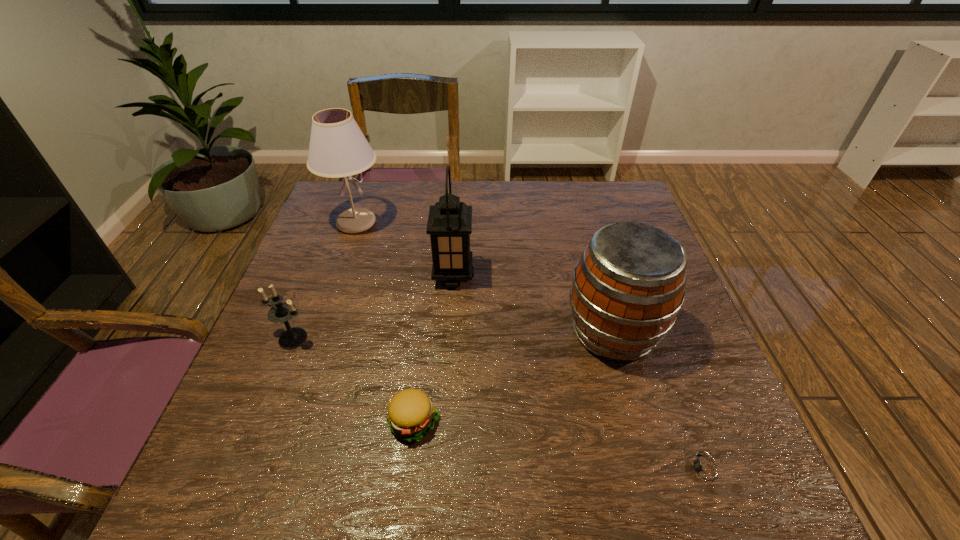
Image resolution: width=960 pixels, height=540 pixels. Find the location of `empty space that is in between the second shortest object and the third tallest object`. empty space that is in between the second shortest object and the third tallest object is located at coordinates (514, 376).

Find the location of a particular element. This screenshot has height=540, width=960. empty space that is in between the fifth nearest object and the fourth shortest object is located at coordinates (533, 303).

Image resolution: width=960 pixels, height=540 pixels. I want to click on vacant region between the second farthest object and the third tallest object, so click(533, 303).

Image resolution: width=960 pixels, height=540 pixels. I want to click on vacant area that lies between the fifth tallest object and the fourth tallest object, so click(353, 379).

Where is `free space between the candle holder and the watch`? The height and width of the screenshot is (540, 960). free space between the candle holder and the watch is located at coordinates (499, 403).

This screenshot has width=960, height=540. In order to click on vacant area that lies between the candle holder and the fifth tallest object in this screenshot , I will do `click(353, 379)`.

This screenshot has width=960, height=540. I want to click on free space that is in between the hamburger and the candle holder, so click(x=353, y=379).

In order to click on free spot between the watch and the hamburger in this screenshot , I will do `click(560, 445)`.

You are a GUI agent. You are given a task and a screenshot of the screen. Output one action in this format:
    pyautogui.click(x=<x>, y=<y>)
    Task: Click on the object that is the nearest to the farthest object
    Image resolution: width=960 pixels, height=540 pixels.
    Given the screenshot: What is the action you would take?
    point(449,224)

Locate an element on the screen. object that is the fifth closest to the farthest object is located at coordinates click(705, 470).